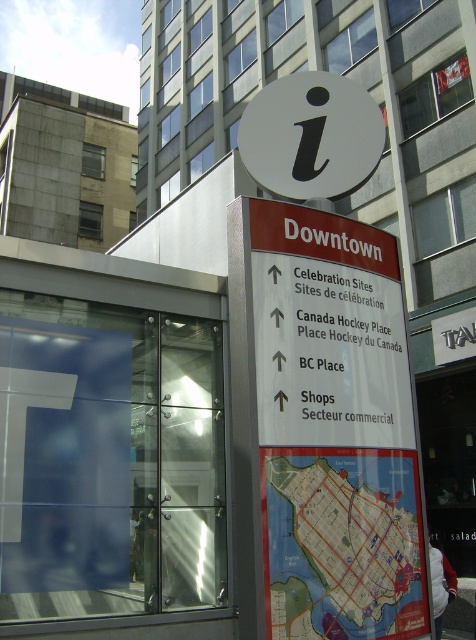
Does map at center have a lesser width compared to white matte sign at center?

Yes.

Who is lower down, map at center or white matte sign at center?

Positioned lower is map at center.

What do you see at coordinates (344, 545) in the screenshot? The height and width of the screenshot is (640, 476). I see `map at center` at bounding box center [344, 545].

Where is `map at center`? The width and height of the screenshot is (476, 640). map at center is located at coordinates (344, 545).